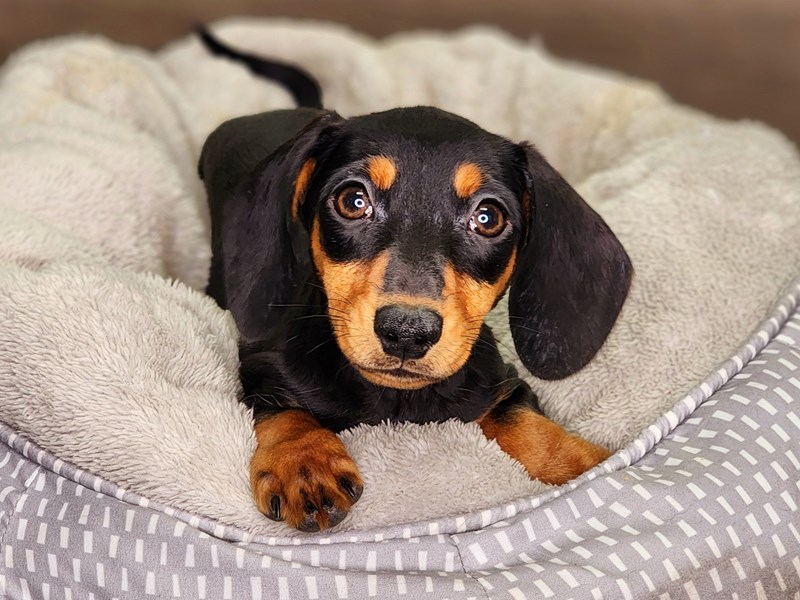
You are a GUI agent. You are given a task and a screenshot of the screen. Output one action in this format:
    pyautogui.click(x=<x>, y=<y>)
    Task: Click on the bedding
    
    Given the screenshot: What is the action you would take?
    pyautogui.click(x=168, y=349), pyautogui.click(x=177, y=537)